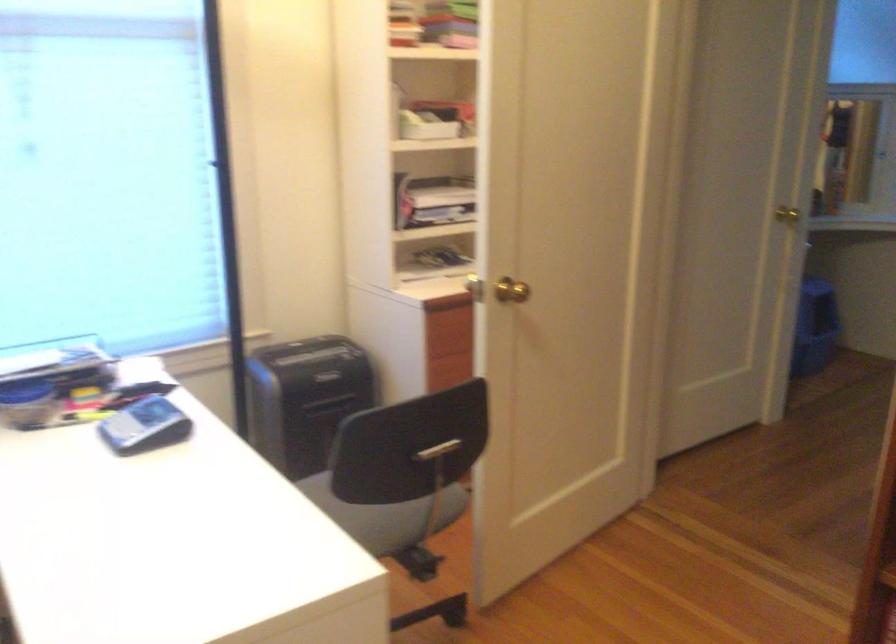
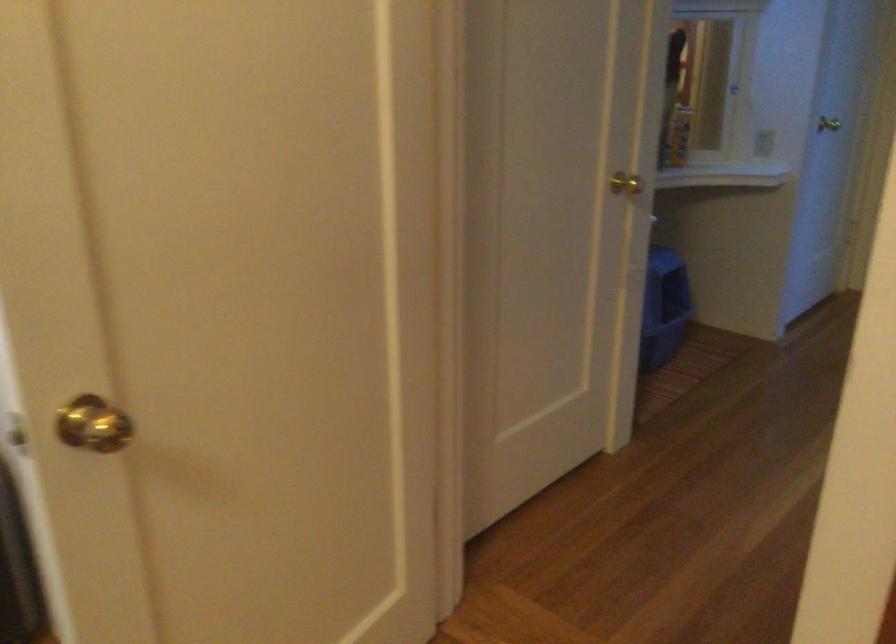
Question: The first image is from the beginning of the video and the second image is from the end. How did the camera likely rotate when shooting the video?

Choices:
 (A) Left
 (B) Right
 (C) Up
 (D) Down

Answer: (B)